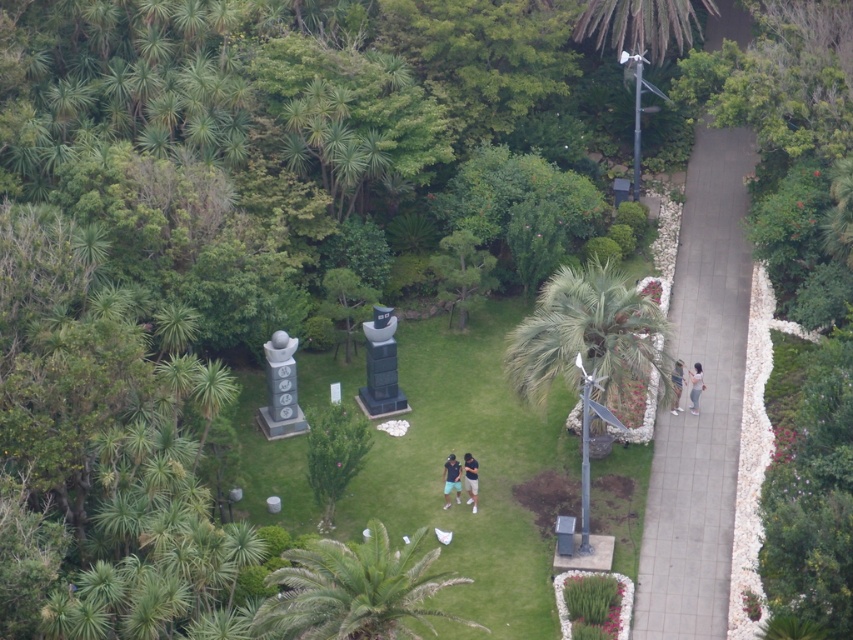
You are a fashion designer observing the two pairs of pants in the image. Which pair, the dark blue jeans at center or the light gray fabric pants at right, has a narrower width?

The dark blue jeans at center is thinner than the light gray fabric pants at right, so the dark blue jeans at center has a narrower width.